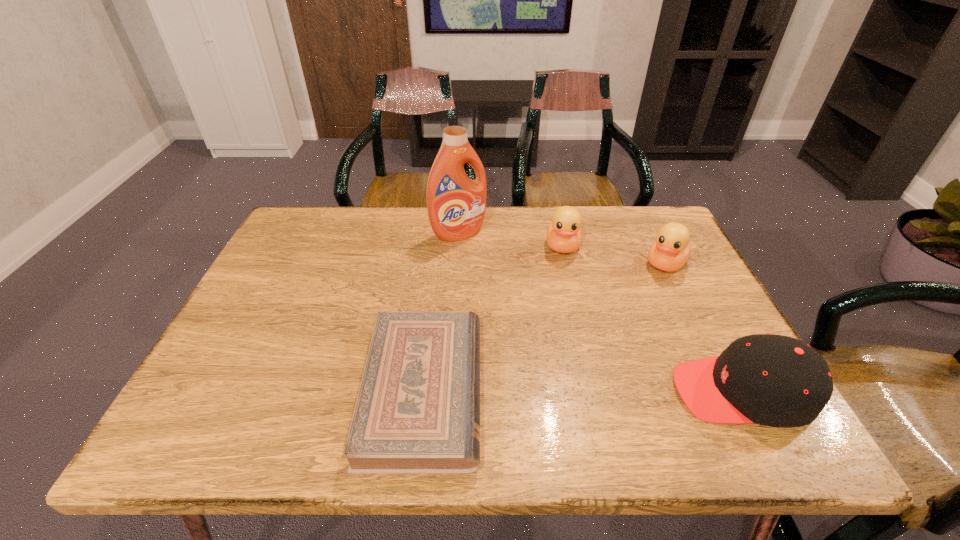
In order to click on vacant point located between the left duckling and the cap in this screenshot , I will do `click(653, 319)`.

The image size is (960, 540). I want to click on free space between the third object from right to left and the detergent, so click(x=511, y=240).

Identify the location of free area in between the right duckling and the cap. (704, 327).

Where is `free space between the Bible and the right duckling`? free space between the Bible and the right duckling is located at coordinates (544, 327).

This screenshot has height=540, width=960. Find the location of `free space between the right duckling and the left duckling`. free space between the right duckling and the left duckling is located at coordinates (614, 255).

Locate an element on the screen. Image resolution: width=960 pixels, height=540 pixels. empty space that is in between the Bible and the left duckling is located at coordinates (493, 318).

The image size is (960, 540). What are the coordinates of `vacant space in between the left duckling and the tallest object` in the screenshot? It's located at (511, 240).

Find the location of a particular element. object identified as the fourth closest to the right duckling is located at coordinates (417, 410).

Choose which object is the nearest neighbor to the left duckling. Please provide its 2D coordinates. Your answer should be formatted as a tuple, i.e. [(x, y)], where the tuple contains the x and y coordinates of a point satisfying the conditions above.

[(669, 252)]

You are a GUI agent. You are given a task and a screenshot of the screen. Output one action in this format:
    pyautogui.click(x=<x>, y=<y>)
    Task: Click on the blank space that satisfies the following two spatial constraints: 1. on the front side of the right duckling; 2. on the left side of the detergent
    Image resolution: width=960 pixels, height=540 pixels.
    Given the screenshot: What is the action you would take?
    pyautogui.click(x=457, y=264)